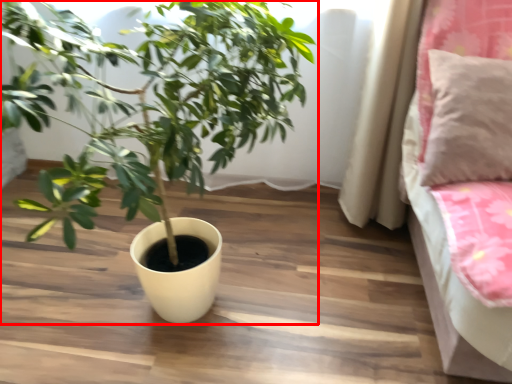
Question: From the image's perspective, where is houseplant (annotated by the red box) located in relation to pillow in the image?

Choices:
 (A) above
 (B) below

Answer: (B)